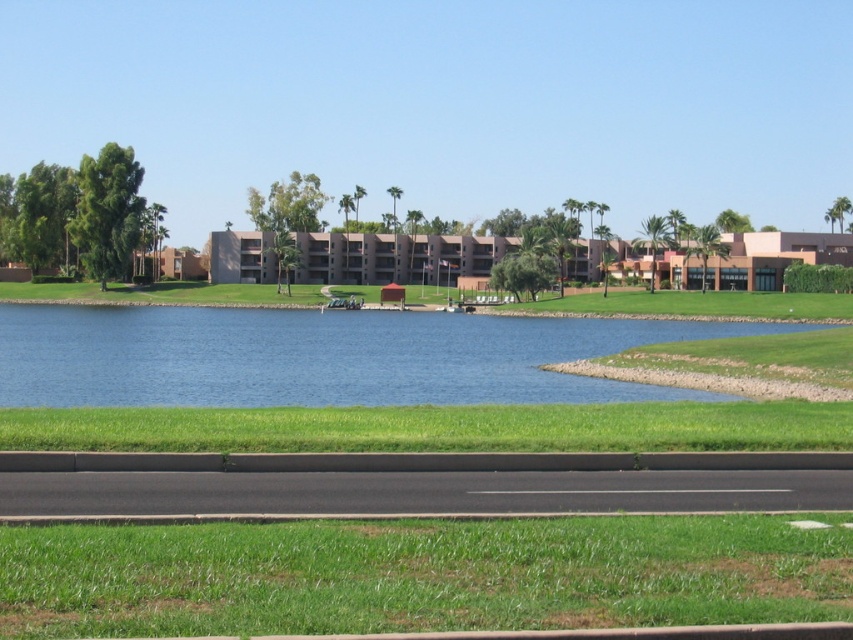
Question: Which object appears closest to the camera in this image?

Choices:
 (A) blue water at center
 (B) green grass at lower center

Answer: (B)

Question: Which of the following is the closest to the observer?

Choices:
 (A) green grass at lower center
 (B) blue water at center

Answer: (A)

Question: Does green grass at lower center appear on the right side of blue water at center?

Choices:
 (A) no
 (B) yes

Answer: (B)

Question: Can you confirm if green grass at lower center is positioned to the left of blue water at center?

Choices:
 (A) yes
 (B) no

Answer: (B)

Question: Does green grass at lower center appear on the left side of blue water at center?

Choices:
 (A) no
 (B) yes

Answer: (A)